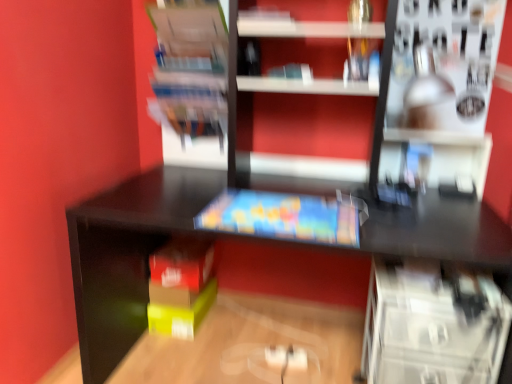
Question: Is matte plastic book at center thinner than satin silver lamp at upper right, the 2th shelf when ordered from bottom to top?

Choices:
 (A) no
 (B) yes

Answer: (B)

Question: Does matte plastic book at center have a greater height compared to satin silver lamp at upper right, the 2th shelf when ordered from bottom to top?

Choices:
 (A) yes
 (B) no

Answer: (B)

Question: Is matte plastic book at center far from satin silver lamp at upper right, the 2th shelf when ordered from bottom to top?

Choices:
 (A) no
 (B) yes

Answer: (A)

Question: From the image's perspective, does matte plastic book at center appear higher than satin silver lamp at upper right, the 2th shelf when ordered from bottom to top?

Choices:
 (A) yes
 (B) no

Answer: (B)

Question: Is matte plastic book at center outside satin silver lamp at upper right, the 2th shelf when ordered from bottom to top?

Choices:
 (A) no
 (B) yes

Answer: (B)

Question: From a real-world perspective, is matte plastic book at center located higher than satin silver lamp at upper right, the 2th shelf when ordered from bottom to top?

Choices:
 (A) no
 (B) yes

Answer: (A)

Question: Is transparent plastic drawers at lower right, which is counted as the second shelf, starting from the right, not close to matte plastic book at center?

Choices:
 (A) yes
 (B) no

Answer: (B)

Question: Is transparent plastic drawers at lower right, which is counted as the second shelf, starting from the right, positioned in front of matte plastic book at center?

Choices:
 (A) yes
 (B) no

Answer: (A)

Question: Is transparent plastic drawers at lower right, placed as the 2th shelf when sorted from left to right, next to matte plastic book at center and touching it?

Choices:
 (A) no
 (B) yes

Answer: (A)

Question: Could you tell me if transparent plastic drawers at lower right, which is counted as the second shelf, starting from the right, is turned towards matte plastic book at center?

Choices:
 (A) no
 (B) yes

Answer: (A)

Question: Does transparent plastic drawers at lower right, which is counted as the second shelf, starting from the right, have a smaller size compared to matte plastic book at center?

Choices:
 (A) no
 (B) yes

Answer: (A)

Question: From the image's perspective, is transparent plastic drawers at lower right, placed as the 2th shelf when sorted from left to right, on top of matte plastic book at center?

Choices:
 (A) no
 (B) yes

Answer: (A)

Question: Considering the relative positions of transparent plastic drawers at lower right, placed as the 2th shelf when sorted from left to right, and satin silver lamp at upper right, which ranks as the first shelf in right-to-left order, in the image provided, is transparent plastic drawers at lower right, placed as the 2th shelf when sorted from left to right, to the right of satin silver lamp at upper right, which ranks as the first shelf in right-to-left order, from the viewer's perspective?

Choices:
 (A) no
 (B) yes

Answer: (A)